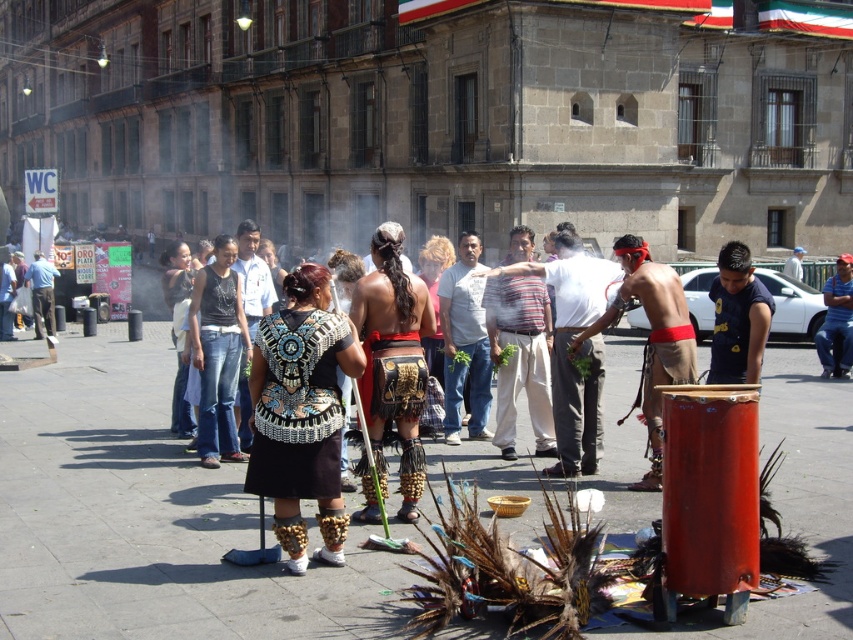
You are a photographer positioned at the center of the square. You want to take a photo of the striped cotton shirt at center. Where should you aim your camera to capture it in the frame?

You should aim your camera at the point with coordinates (520, 356) to capture the striped cotton shirt at center in the frame.

You are attending a cultural event in the square and want to locate the shiny metallic drum at center. According to the coordinates provided, where should you look relative to the large stone building in the background?

The shiny metallic drum at center is located at coordinates point (567, 346), which places it in the lower central area relative to the large stone building in the background.